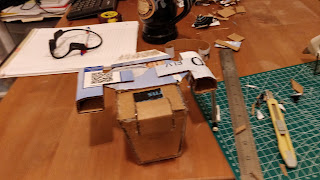
Image resolution: width=320 pixels, height=180 pixels. I want to click on pen, so click(86, 35), click(214, 108).